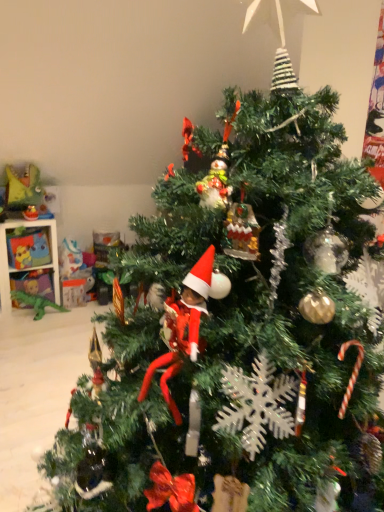
Question: Can you confirm if matte yellow plush toy at left, which appears as the 1th toy when viewed from the top, is smaller than green plastic dinosaur at left, the third toy in the top-to-bottom sequence?

Choices:
 (A) yes
 (B) no

Answer: (B)

Question: From a real-world perspective, is matte yellow plush toy at left, which appears as the 1th toy when viewed from the top, under green plastic dinosaur at left, marked as the 1th toy in a bottom-to-top arrangement?

Choices:
 (A) no
 (B) yes

Answer: (A)

Question: Is matte yellow plush toy at left, which appears as the 1th toy when viewed from the top, far from green plastic dinosaur at left, the third toy in the top-to-bottom sequence?

Choices:
 (A) yes
 (B) no

Answer: (B)

Question: Is matte yellow plush toy at left, which appears as the 1th toy when viewed from the top, taller than green plastic dinosaur at left, the third toy in the top-to-bottom sequence?

Choices:
 (A) yes
 (B) no

Answer: (A)

Question: Can you confirm if matte yellow plush toy at left, which appears as the 1th toy when viewed from the top, is shorter than green plastic dinosaur at left, marked as the 1th toy in a bottom-to-top arrangement?

Choices:
 (A) no
 (B) yes

Answer: (A)

Question: Is the position of matte yellow plush toy at left, the third toy when ordered from bottom to top, less distant than that of green plastic dinosaur at left, marked as the 1th toy in a bottom-to-top arrangement?

Choices:
 (A) yes
 (B) no

Answer: (A)

Question: From the image's perspective, does matte yellow toy at upper left, placed as the 2th toy when sorted from top to bottom, appear lower than matte yellow plush toy at left, the third toy when ordered from bottom to top?

Choices:
 (A) yes
 (B) no

Answer: (A)

Question: From the image's perspective, is matte yellow toy at upper left, placed as the 2th toy when sorted from top to bottom, over matte yellow plush toy at left, the third toy when ordered from bottom to top?

Choices:
 (A) no
 (B) yes

Answer: (A)

Question: Can you confirm if matte yellow toy at upper left, placed as the 2th toy when sorted from top to bottom, is taller than matte yellow plush toy at left, which appears as the 1th toy when viewed from the top?

Choices:
 (A) no
 (B) yes

Answer: (A)

Question: Is matte yellow toy at upper left, arranged as the 2th toy when ordered from the bottom, wider than matte yellow plush toy at left, the third toy when ordered from bottom to top?

Choices:
 (A) yes
 (B) no

Answer: (B)

Question: Is the depth of matte yellow toy at upper left, arranged as the 2th toy when ordered from the bottom, less than that of matte yellow plush toy at left, which appears as the 1th toy when viewed from the top?

Choices:
 (A) no
 (B) yes

Answer: (A)

Question: Considering the relative sizes of matte yellow toy at upper left, placed as the 2th toy when sorted from top to bottom, and matte yellow plush toy at left, which appears as the 1th toy when viewed from the top, in the image provided, is matte yellow toy at upper left, placed as the 2th toy when sorted from top to bottom, shorter than matte yellow plush toy at left, which appears as the 1th toy when viewed from the top,?

Choices:
 (A) yes
 (B) no

Answer: (A)

Question: Considering the relative sizes of green plastic dinosaur at left, the third toy in the top-to-bottom sequence, and matte yellow plush toy at left, the third toy when ordered from bottom to top, in the image provided, is green plastic dinosaur at left, the third toy in the top-to-bottom sequence, wider than matte yellow plush toy at left, the third toy when ordered from bottom to top,?

Choices:
 (A) no
 (B) yes

Answer: (A)